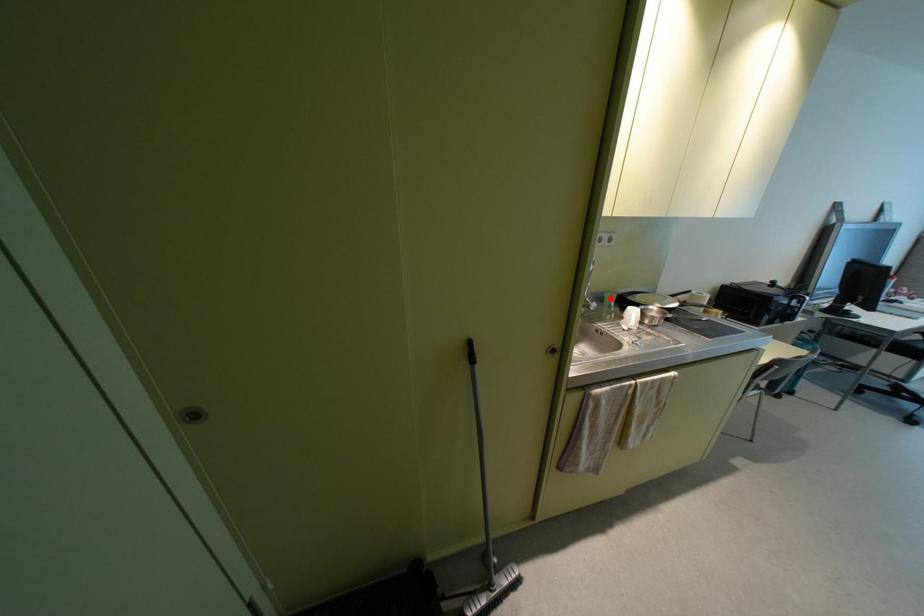
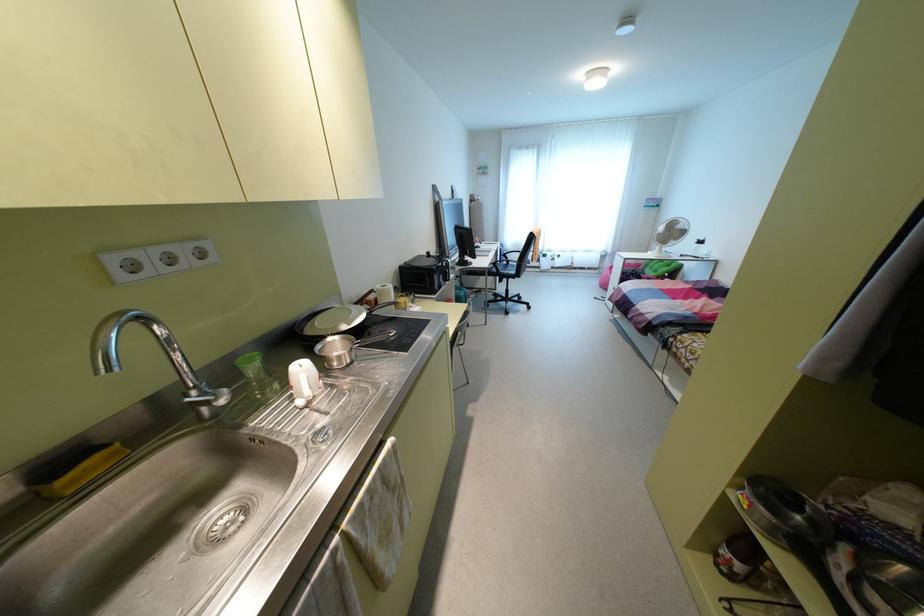
In the second image, find the point that corresponds to the highlighted location in the first image.

(251, 366)